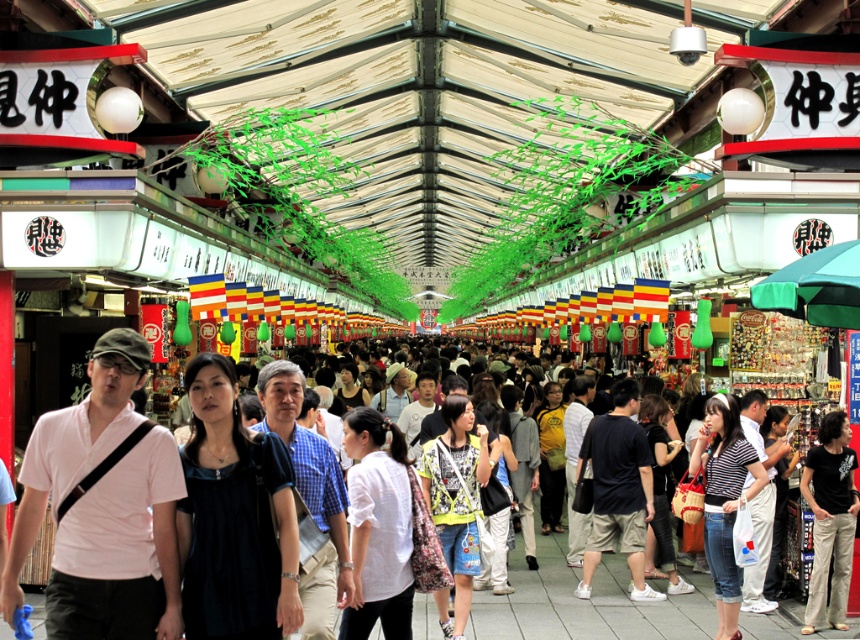
Question: Does yellow printed shirt at center appear over yellow matte shirt at center?

Choices:
 (A) yes
 (B) no

Answer: (A)

Question: Does yellow printed shirt at center appear on the left side of light gray fabric backpack at center?

Choices:
 (A) no
 (B) yes

Answer: (B)

Question: Which object appears closest to the camera in this image?

Choices:
 (A) dark blue fabric shirt at center
 (B) striped cotton shirt at center
 (C) yellow printed shirt at center

Answer: (A)

Question: Which of the following is the closest to the observer?

Choices:
 (A) denim shorts at center
 (B) white matte shirt at center

Answer: (B)

Question: Which point is closer to the camera taking this photo?

Choices:
 (A) (474, 460)
 (B) (394, 506)
 (C) (539, 417)
 (D) (733, 561)

Answer: (B)

Question: Does striped cotton shirt at center appear over black cotton shirt at center?

Choices:
 (A) no
 (B) yes

Answer: (B)